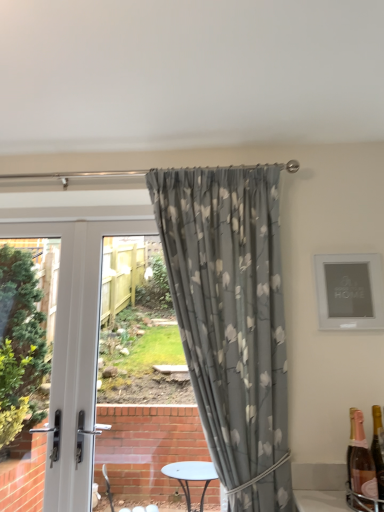
Question: Is matte silver picture frame at upper right aimed at pink glass bottle at lower right, which ranks as the 2th bottle in front-to-back order?

Choices:
 (A) no
 (B) yes

Answer: (A)

Question: Is matte silver picture frame at upper right touching pink glass bottle at lower right, placed as the 1th bottle when sorted from right to left?

Choices:
 (A) yes
 (B) no

Answer: (B)

Question: Is matte silver picture frame at upper right to the right of pink glass bottle at lower right, which ranks as the 2th bottle in front-to-back order, from the viewer's perspective?

Choices:
 (A) no
 (B) yes

Answer: (A)

Question: Is matte silver picture frame at upper right outside of pink glass bottle at lower right, which ranks as the 2th bottle in front-to-back order?

Choices:
 (A) no
 (B) yes

Answer: (B)

Question: Does matte silver picture frame at upper right come behind pink glass bottle at lower right, which ranks as the 2th bottle in front-to-back order?

Choices:
 (A) yes
 (B) no

Answer: (A)

Question: Considering the relative sizes of matte silver picture frame at upper right and pink glass bottle at lower right, which ranks as the 2th bottle in front-to-back order, in the image provided, is matte silver picture frame at upper right thinner than pink glass bottle at lower right, which ranks as the 2th bottle in front-to-back order,?

Choices:
 (A) no
 (B) yes

Answer: (B)

Question: Is gold metallic bottle at lower right, which is counted as the 2th bottle, starting from the back, aimed at white glossy door at left?

Choices:
 (A) no
 (B) yes

Answer: (A)

Question: From the image's perspective, is gold metallic bottle at lower right, which is counted as the 2th bottle, starting from the back, beneath white glossy door at left?

Choices:
 (A) no
 (B) yes

Answer: (B)

Question: Considering the relative sizes of gold metallic bottle at lower right, the 1th bottle positioned from the left, and white glossy door at left in the image provided, is gold metallic bottle at lower right, the 1th bottle positioned from the left, taller than white glossy door at left?

Choices:
 (A) no
 (B) yes

Answer: (A)

Question: Is gold metallic bottle at lower right, the 2th bottle when ordered from right to left, at the right side of white glossy door at left?

Choices:
 (A) yes
 (B) no

Answer: (A)

Question: Are gold metallic bottle at lower right, the 1th bottle positioned from the left, and white glossy door at left beside each other?

Choices:
 (A) no
 (B) yes

Answer: (A)

Question: Is gold metallic bottle at lower right, the 1th bottle positioned from the left, further to the viewer compared to white glossy door at left?

Choices:
 (A) no
 (B) yes

Answer: (A)

Question: Is gray floral fabric curtain at center shorter than white glossy door at left?

Choices:
 (A) no
 (B) yes

Answer: (B)